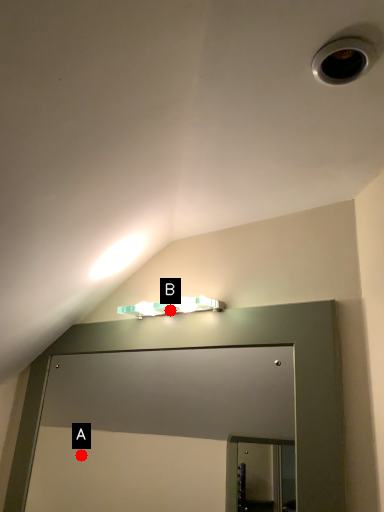
Question: Two points are circled on the image, labeled by A and B beside each circle. Which point is further to the camera?

Choices:
 (A) A is further
 (B) B is further

Answer: (A)